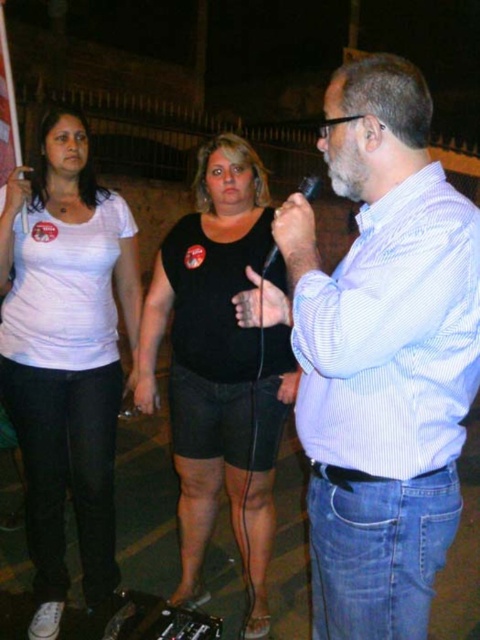
Is white striped shirt at center smaller than black matte tank top at center?

Yes, white striped shirt at center is smaller than black matte tank top at center.

Between point (464, 400) and point (241, 163), which one is positioned behind?

Positioned behind is point (241, 163).

Who is more forward, (339, 170) or (156, 346)?

Point (339, 170) is in front.

This screenshot has height=640, width=480. In order to click on white striped shirt at center in this screenshot , I will do `click(383, 356)`.

Can you confirm if white striped shirt at center is positioned to the right of white matte t-shirt at left?

Yes, white striped shirt at center is to the right of white matte t-shirt at left.

Does white striped shirt at center have a larger size compared to white matte t-shirt at left?

Incorrect, white striped shirt at center is not larger than white matte t-shirt at left.

Where is `white striped shirt at center`? white striped shirt at center is located at coordinates (383, 356).

Which is in front, point (8, 266) or point (416, 321)?

Point (416, 321) is in front.

This screenshot has height=640, width=480. Identify the location of white matte t-shirt at left. (66, 356).